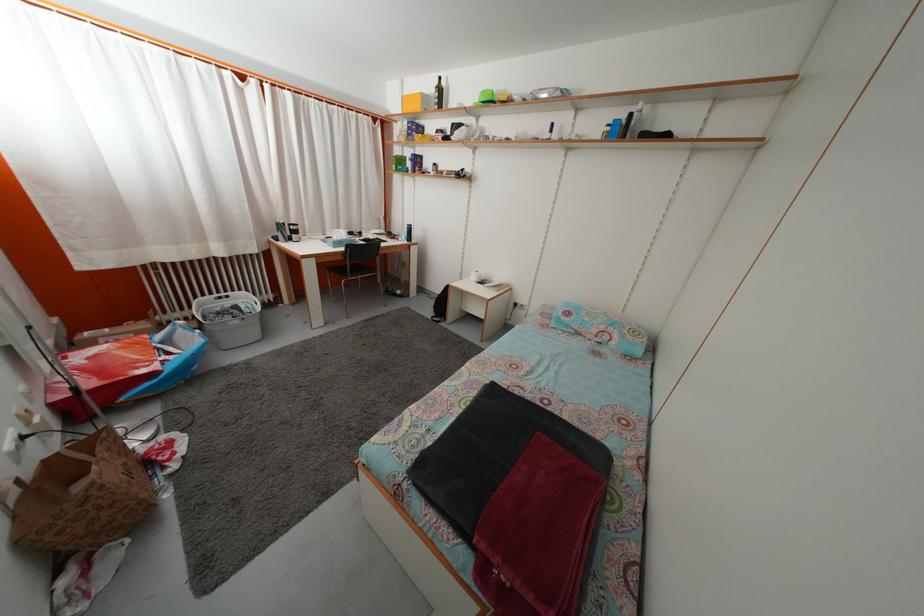
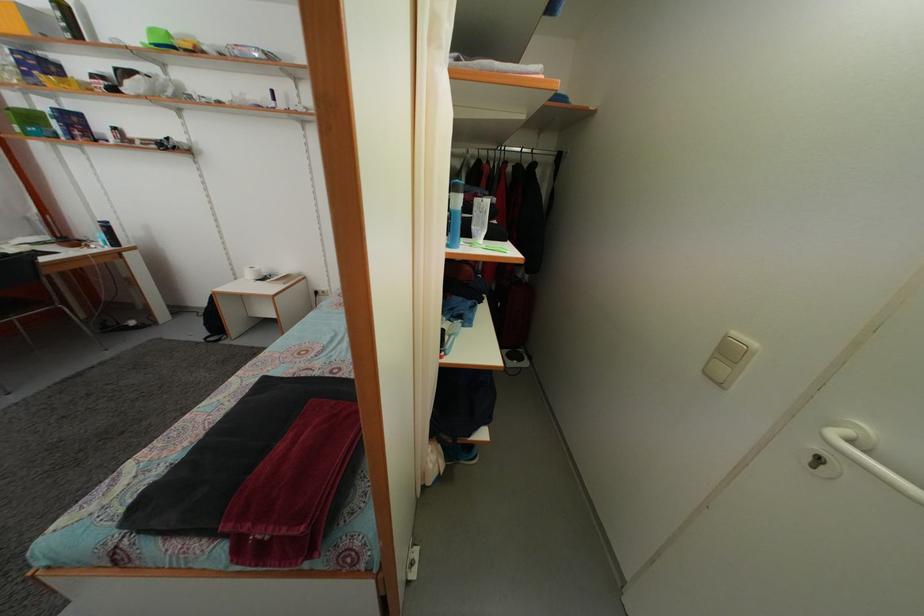
Question: Based on the continuous images, in which direction is the camera rotating? Reply with the corresponding letter.

Choices:
 (A) Left
 (B) Right
 (C) Up
 (D) Down

Answer: (B)